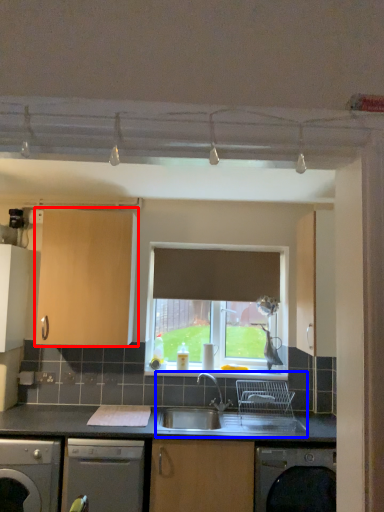
Question: Which object appears farthest to the camera in this image, cabinetry (highlighted by a red box) or sink (highlighted by a blue box)?

Choices:
 (A) cabinetry
 (B) sink

Answer: (A)